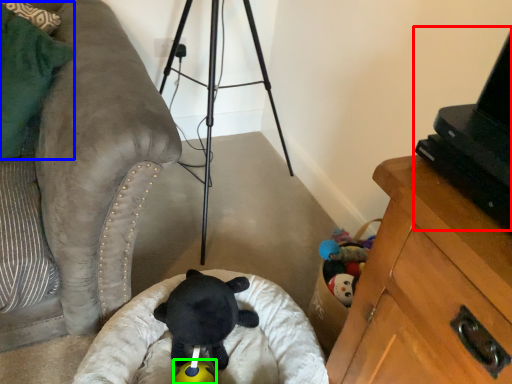
Question: Which object is the closest to the computer (highlighted by a red box)? Choose among these: pillow (highlighted by a blue box) or toy (highlighted by a green box).

Choices:
 (A) pillow
 (B) toy

Answer: (B)